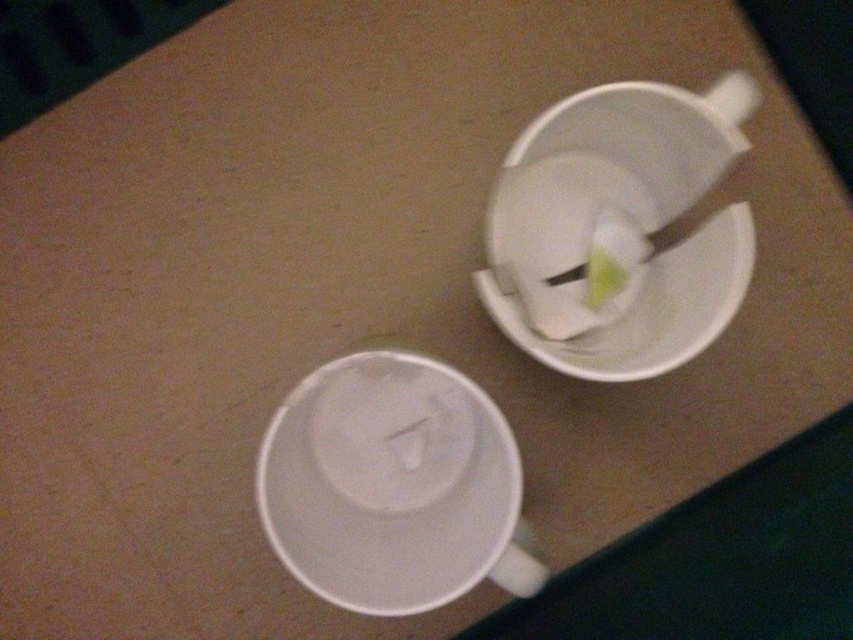
Which is behind, point (430, 397) or point (546, 340)?

The point (430, 397) is more distant.

I want to click on white matte saucer at lower left, so click(x=392, y=486).

Measure the distance between white matte saucer at lower left and camera.

32.08 inches

This screenshot has height=640, width=853. What are the coordinates of `white matte saucer at lower left` in the screenshot? It's located at (392, 486).

Measure the distance from white matte saucer at center to white matte saucer at upper right.

They are 7.75 inches apart.

Between point (361, 385) and point (672, 257), which one is positioned in front?

Point (672, 257) is in front.

Where is `white matte saucer at center`? This screenshot has width=853, height=640. white matte saucer at center is located at coordinates (392, 429).

Find the location of `white matte saucer at center`. white matte saucer at center is located at coordinates (392, 429).

Can you confirm if white matte saucer at lower left is wider than white matte saucer at center?

Indeed, white matte saucer at lower left has a greater width compared to white matte saucer at center.

Image resolution: width=853 pixels, height=640 pixels. Describe the element at coordinates (392, 486) in the screenshot. I see `white matte saucer at lower left` at that location.

Locate an element on the screen. white matte saucer at lower left is located at coordinates (392, 486).